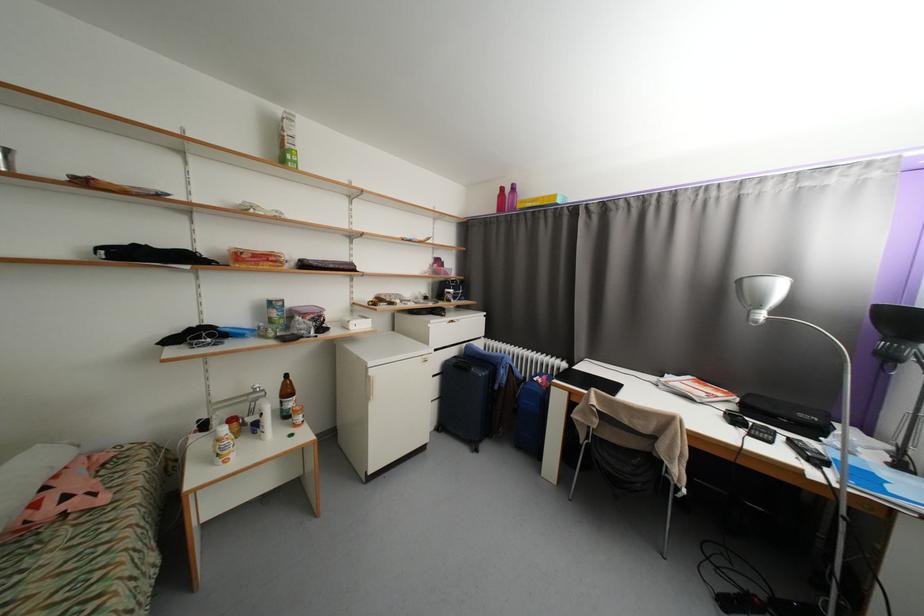
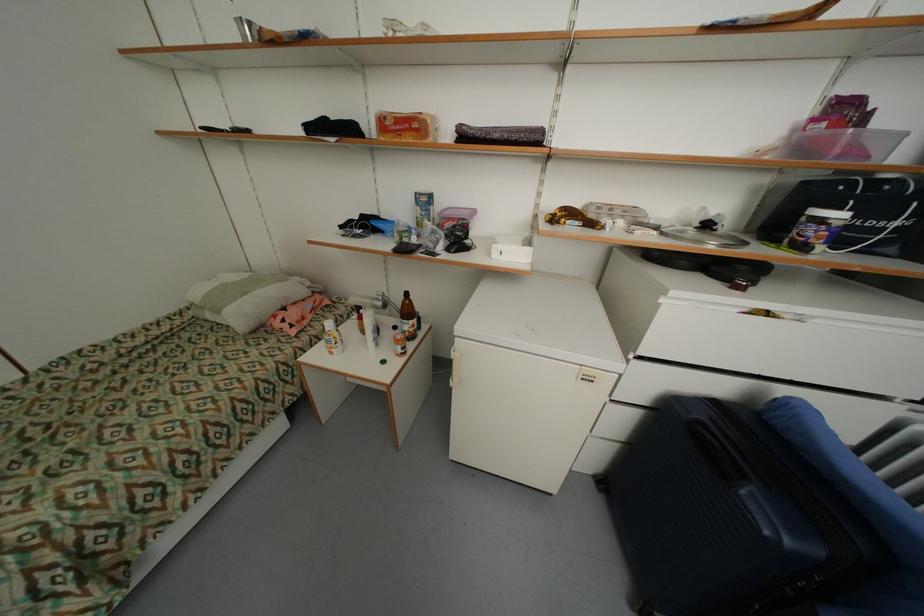
The point at (442, 434) is marked in the first image. Where is the corresponding point in the second image?

(599, 483)